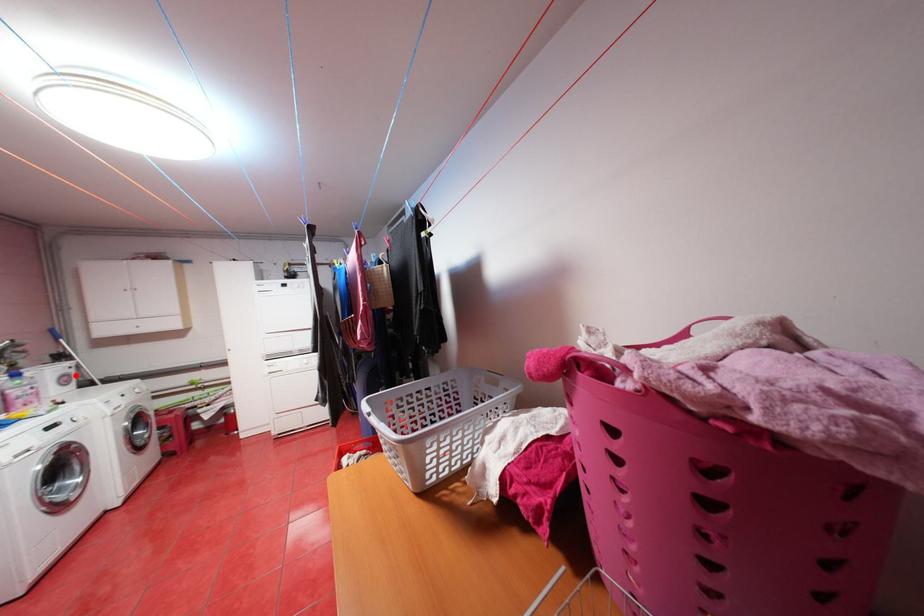
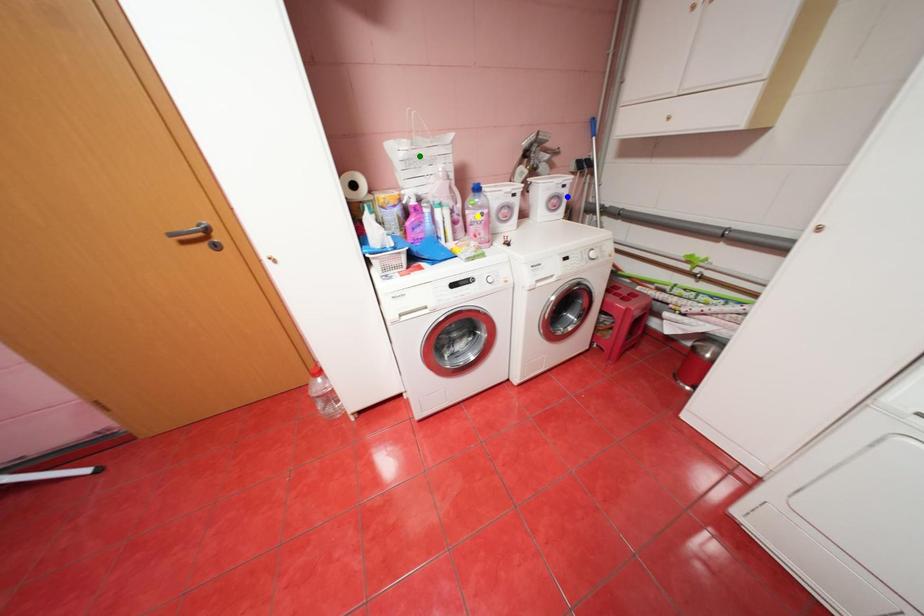
Question: I am providing you with two images of the same scene from different viewpoints. A red point is marked on the first image. You are given multiple points on the second image. Can you choose the point in image 2 that corresponds to the point in image 1?

Choices:
 (A) blue point
 (B) green point
 (C) yellow point

Answer: (A)